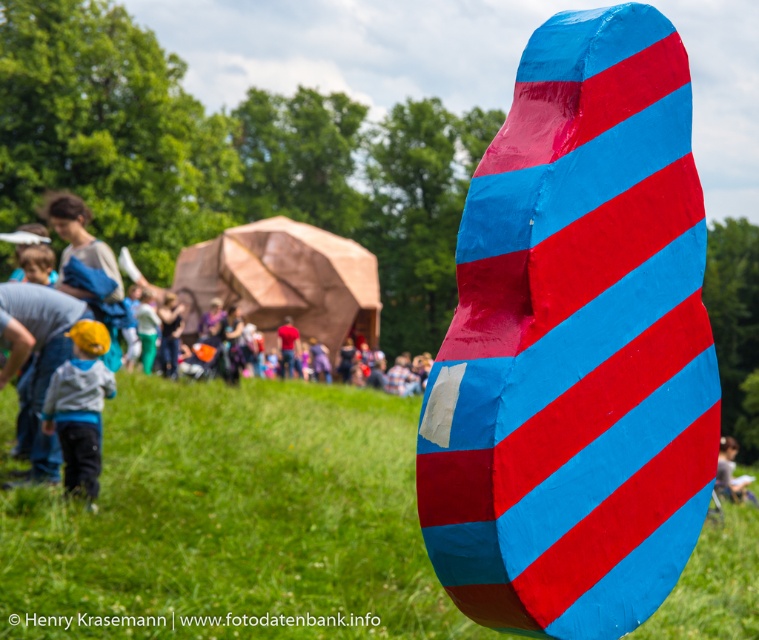
You are standing at the point marked as point [524,465] and want to walk towards the point marked as point [748,492]. Will you have to go through any obstacles along the way?

Point [524,465] is in front of point [748,492], so there are no obstacles between them. You can walk directly from point [524,465] to point [748,492] without any hindrance.

You are standing at the entrance of the event and see the shiny plastic rock at center. If you walk directly towards it, which direction should you move relative to your current position?

The shiny plastic rock at center is located at point (575, 342), so you should move forward and slightly to the right to reach it.